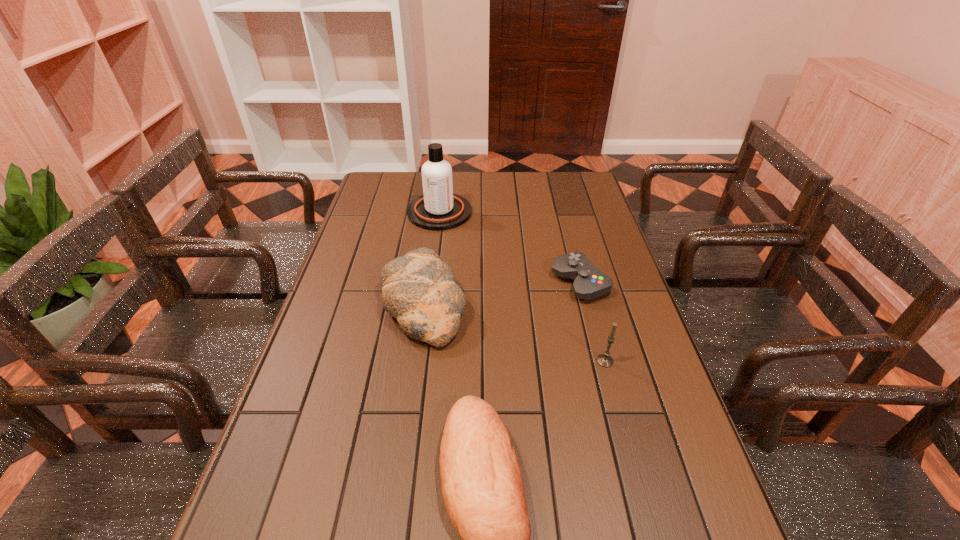
Locate an element on the screen. The height and width of the screenshot is (540, 960). object that is positioned at the left edge is located at coordinates (418, 289).

Find the location of `candle at the right edge`. candle at the right edge is located at coordinates (605, 360).

I want to click on control that is at the right edge, so click(x=590, y=282).

The image size is (960, 540). Find the location of `free space at the far edge of the desktop`. free space at the far edge of the desktop is located at coordinates (417, 197).

The width and height of the screenshot is (960, 540). Identify the location of vacant area at the left edge of the desktop. (331, 430).

Identify the location of vacant space at the right edge of the desktop. (621, 336).

I want to click on free space at the far left corner of the desktop, so click(x=408, y=185).

Identify the location of free space at the far right corner of the desktop. This screenshot has width=960, height=540. (572, 179).

The width and height of the screenshot is (960, 540). What are the coordinates of `vacant area that lies between the candle and the taller bread` in the screenshot? It's located at (514, 332).

This screenshot has width=960, height=540. I want to click on free area in between the candle and the taller bread, so click(514, 332).